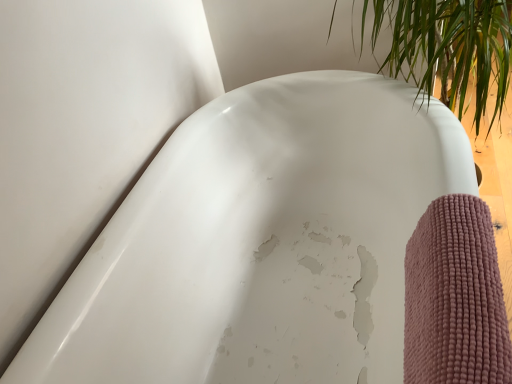
You are a GUI agent. You are given a task and a screenshot of the screen. Output one action in this format:
    pyautogui.click(x=<x>, y=<y>)
    Task: Click on the pink textured towel at right
    
    Given the screenshot: What is the action you would take?
    pyautogui.click(x=455, y=298)

Consider the image. Measure the distance between point (439, 364) and camera.

Point (439, 364) is 59.60 centimeters from camera.

Describe the element at coordinates (455, 298) in the screenshot. I see `pink textured towel at right` at that location.

Locate an element on the screen. The width and height of the screenshot is (512, 384). pink textured towel at right is located at coordinates (x=455, y=298).